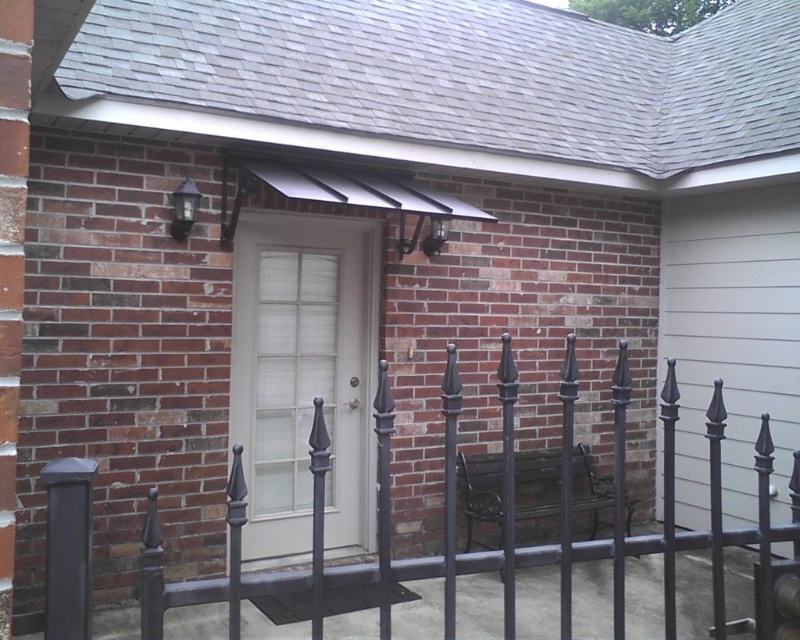
You are standing in front of the residential building and want to determine the relative positions of two points marked on the image. The first point is located at coordinates point (666, 461) and the second at point (328, 544). Which point appears closer to you?

Point (666, 461) is further to the camera than point (328, 544), so the second point appears closer to you.

You are a delivery person trying to see if you can fit a large package through the space between the black wrought iron fence at center and the white glass door at center. Based on their heights, can the package pass through vertically without tilting?

The black wrought iron fence at center is not as tall as the white glass door at center, so the package can pass through vertically since the fence is shorter and won

You are a delivery person trying to wheel a large package through the entrance. The package is 1.2 meters wide. Based on the image, can you determine if the space between the black wrought iron fence at center and the white glass door at center is wide enough to pass through?

The black wrought iron fence at center might be wider than the white glass door at center, so the space between them may be insufficient for a 1.2 meter wide package. It is uncertain if the package will fit without more precise measurements.